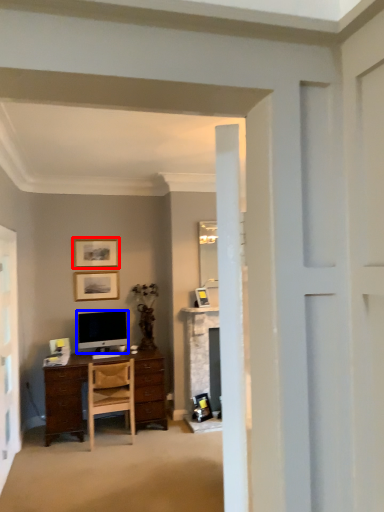
Question: Which point is further to the camera, picture frame (highlighted by a red box) or television (highlighted by a blue box)?

Choices:
 (A) picture frame
 (B) television

Answer: (A)